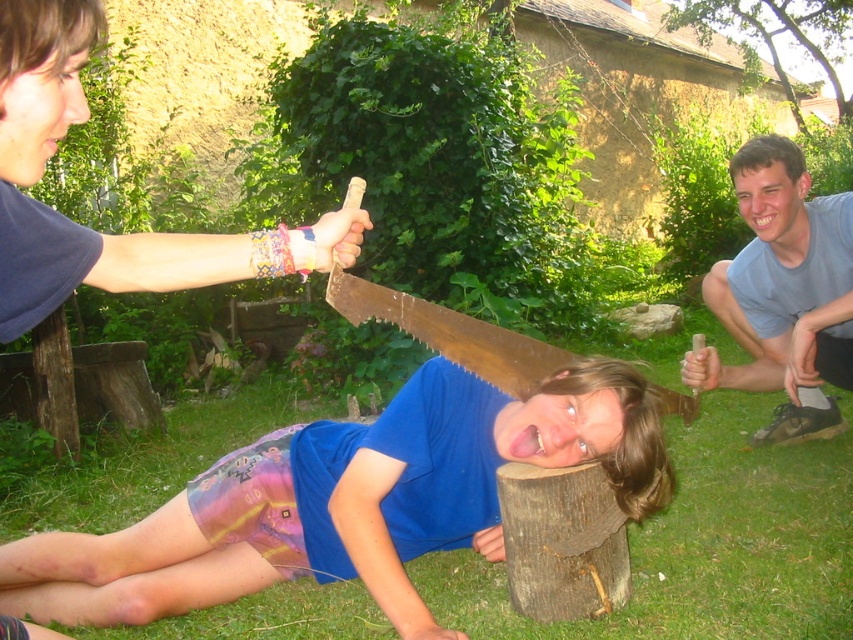
You are standing in the backyard and want to place a small flag at the point closer to you between point A at point (735, 420) and point B at point (822, 332). Which point should you choose?

Point A at point (735, 420) is closer to you than point B at point (822, 332), so you should choose point A at point (735, 420).

From the picture: You are standing in the backyard and want to place a small flower pot between the green grass at lower center and the gray cotton shirt at lower right. Based on their positions, which object should the flower pot be closer to?

The green grass at lower center is closer to the viewer than the gray cotton shirt at lower right, so the flower pot should be placed closer to the gray cotton shirt at lower right to maintain equal distance between both objects.

You are a photographer setting up a shot in the backyard. You need to place a small tripod between the green grass at lower center and the gray cotton shirt at lower right. Which object should you place the tripod closer to to ensure it fits within the narrower space?

You should place the tripod closer to the gray cotton shirt at lower right because its width is narrower than the green grass at lower center.